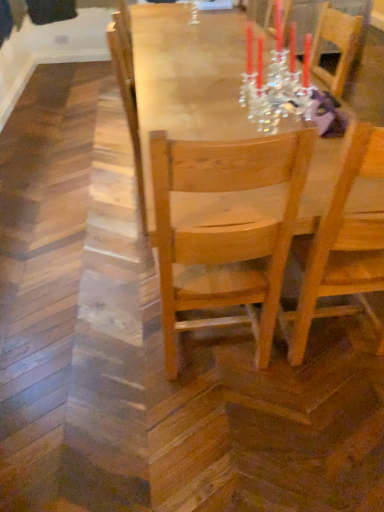
Question: Is wooden table at center further to the viewer compared to light wood chair at center, positioned as the 1th chair in left-to-right order?

Choices:
 (A) no
 (B) yes

Answer: (B)

Question: Does wooden table at center appear on the left side of light wood chair at center, the 2th chair positioned from the right?

Choices:
 (A) yes
 (B) no

Answer: (B)

Question: From the image's perspective, is wooden table at center located beneath light wood chair at center, the 2th chair positioned from the right?

Choices:
 (A) no
 (B) yes

Answer: (A)

Question: Is wooden table at center taller than light wood chair at center, the 2th chair positioned from the right?

Choices:
 (A) no
 (B) yes

Answer: (A)

Question: Could you tell me if wooden table at center is facing light wood chair at center, positioned as the 1th chair in left-to-right order?

Choices:
 (A) no
 (B) yes

Answer: (A)

Question: Can you confirm if wooden table at center is wider than light wood chair at center, positioned as the 1th chair in left-to-right order?

Choices:
 (A) no
 (B) yes

Answer: (B)

Question: From the image's perspective, is light wood chair at center, the 2th chair positioned from the right, located beneath wooden chair at center, the first chair from the right?

Choices:
 (A) no
 (B) yes

Answer: (B)

Question: Is light wood chair at center, the 2th chair positioned from the right, turned away from wooden chair at center, the first chair from the right?

Choices:
 (A) yes
 (B) no

Answer: (B)

Question: Does light wood chair at center, the 2th chair positioned from the right, come behind wooden chair at center, the second chair when ordered from left to right?

Choices:
 (A) no
 (B) yes

Answer: (A)

Question: Is light wood chair at center, the 2th chair positioned from the right, wider than wooden chair at center, the first chair from the right?

Choices:
 (A) no
 (B) yes

Answer: (A)

Question: From a real-world perspective, is light wood chair at center, the 2th chair positioned from the right, located higher than wooden chair at center, the second chair when ordered from left to right?

Choices:
 (A) no
 (B) yes

Answer: (A)

Question: Does light wood chair at center, positioned as the 1th chair in left-to-right order, touch wooden chair at center, the first chair from the right?

Choices:
 (A) no
 (B) yes

Answer: (A)

Question: Is light wood chair at center, positioned as the 1th chair in left-to-right order, at the left side of wooden table at center?

Choices:
 (A) no
 (B) yes

Answer: (B)